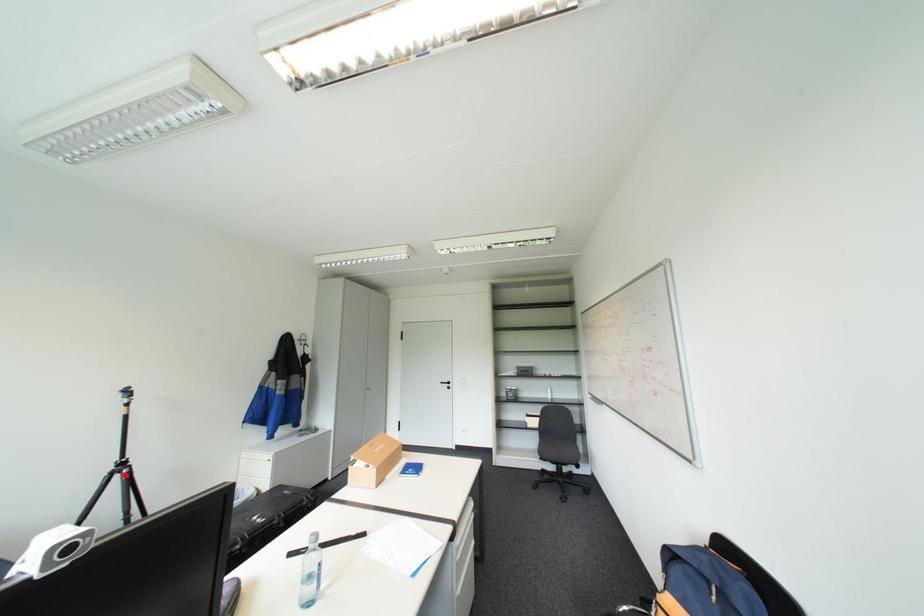
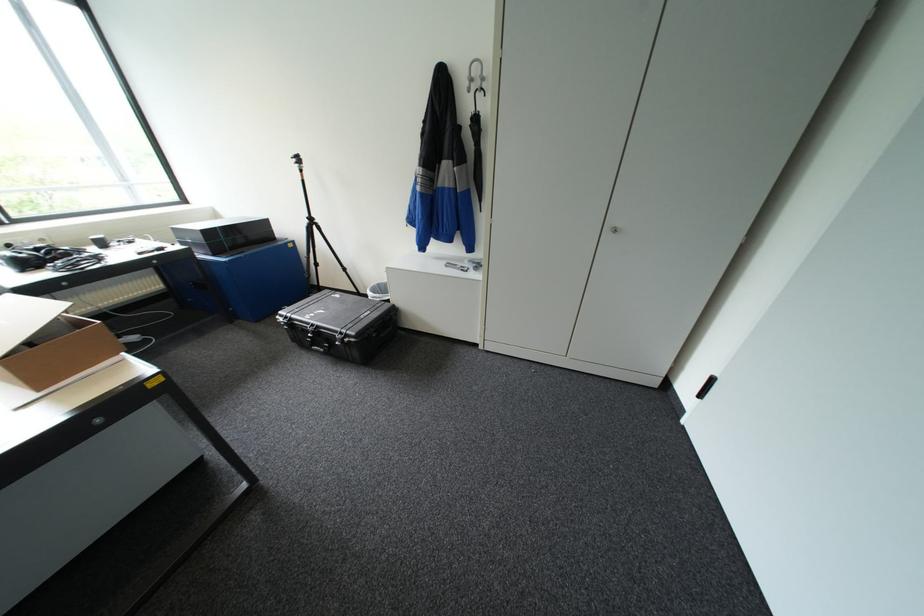
Question: I am providing you with two images of the same scene from different viewpoints. A red point is shown in image1. For the corresponding object point in image2, is it positioned nearer or farther from the camera?

Choices:
 (A) Nearer
 (B) Farther

Answer: (A)